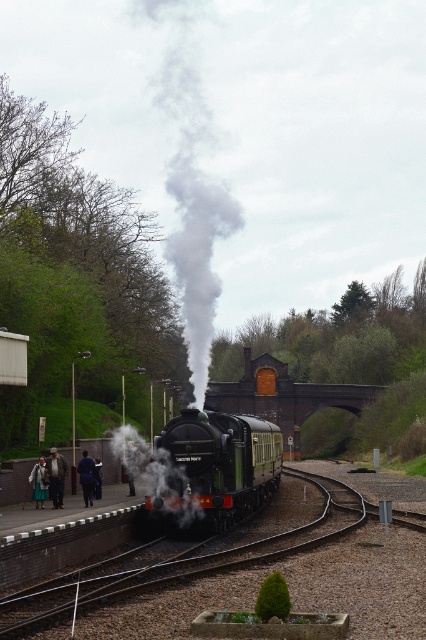
Does dark blue coat at lower left have a larger size compared to light blue denim jacket at left?

No, dark blue coat at lower left is not bigger than light blue denim jacket at left.

Can you confirm if dark blue coat at lower left is positioned below light blue denim jacket at left?

Indeed, dark blue coat at lower left is positioned under light blue denim jacket at left.

Which is in front, point (88, 465) or point (39, 467)?

Point (88, 465) is more forward.

I want to click on dark blue coat at lower left, so click(86, 477).

Does point (54, 486) lie in front of point (40, 497)?

Yes, point (54, 486) is closer to viewer.

Who is higher up, light brown leather coat at lower left or light blue denim jacket at left?

Positioned higher is light brown leather coat at lower left.

The image size is (426, 640). Find the location of `light brown leather coat at lower left`. light brown leather coat at lower left is located at coordinates (55, 476).

Does point (60, 465) come in front of point (86, 483)?

Yes, it is.

This screenshot has height=640, width=426. I want to click on light brown leather coat at lower left, so click(x=55, y=476).

Where is `light brown leather coat at lower left`? This screenshot has width=426, height=640. light brown leather coat at lower left is located at coordinates (55, 476).